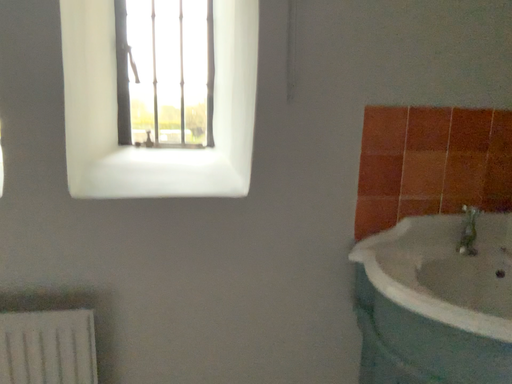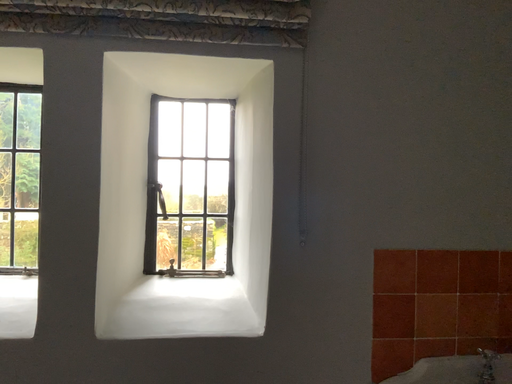
Question: How did the camera likely rotate when shooting the video?

Choices:
 (A) rotated downward
 (B) rotated upward

Answer: (B)